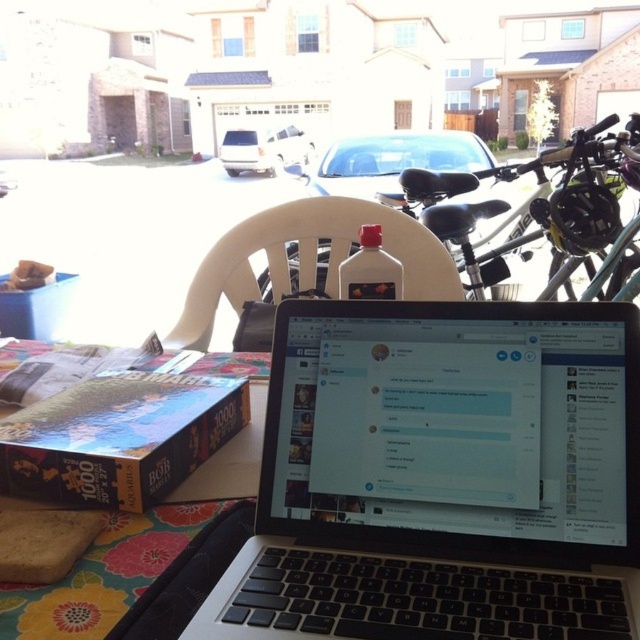
Question: Which point is farther from the camera taking this photo?

Choices:
 (A) (333, 628)
 (B) (440, 189)

Answer: (B)

Question: Which point is farther to the camera?

Choices:
 (A) metallic silver bicycle at right
 (B) silver/black laptop at center

Answer: (A)

Question: Is silver/black laptop at center further to camera compared to metallic silver bicycle at right?

Choices:
 (A) yes
 (B) no

Answer: (B)

Question: From the image, what is the correct spatial relationship of silver/black laptop at center in relation to metallic silver bicycle at right?

Choices:
 (A) left
 (B) right

Answer: (A)

Question: Is silver/black laptop at center below metallic silver bicycle at right?

Choices:
 (A) no
 (B) yes

Answer: (B)